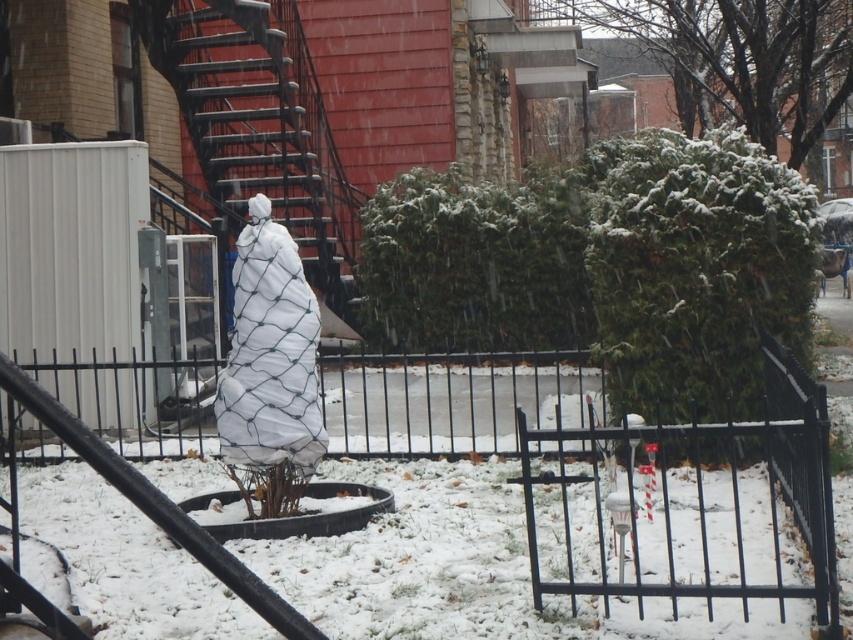
You are standing in the snowy scene and want to walk to the back of the black metal fence at center. The metallic black staircase at center is in your way. Can you easily walk around the staircase to reach the fence?

The black metal fence at center is smaller than the metallic black staircase at center, so the staircase is larger. Since the staircase is in your way and it is larger, it might block your path. You may need to find another route or go around the staircase to reach the fence.

You are standing at the bottom of a metallic black staircase at center and want to reach the point marked at coordinate point (260,128). Which direction should you move to reach that point?

The point (260,128) is on the metallic black staircase at center, so you should move upwards along the metallic black staircase at center to reach it.

You are standing in a snowy urban area and want to take a photo of the black metal fence at center. If your camera has a maximum focus range of 6 meters, will it be able to capture the fence clearly?

The black metal fence at center is 6.59 meters away from the camera, which exceeds the maximum focus range of 6 meters. Therefore, the camera will not be able to capture the fence clearly.